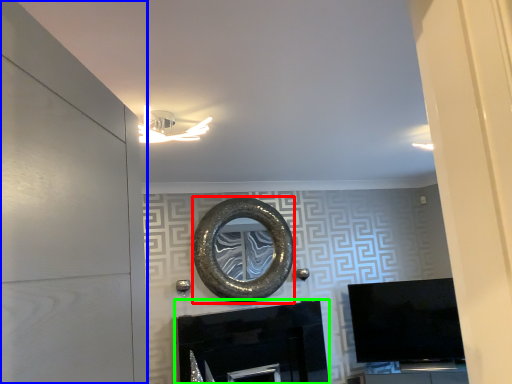
Question: Which object is positioned closest to oval (highlighted by a red box)? Select from door (highlighted by a blue box) and fireplace (highlighted by a green box).

Choices:
 (A) door
 (B) fireplace

Answer: (B)